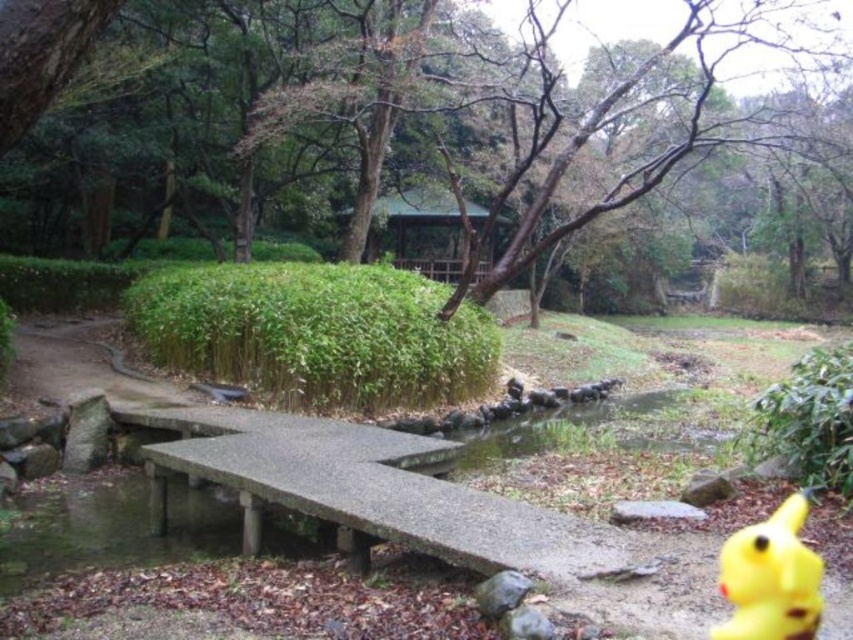
You are standing at the concrete bench in the foreground of the scene. You notice two points marked in the image. Which point, point 1 at coordinates [263,413] or point 2 at coordinates [759,570], is closer to you?

Point 1 at coordinates [263,413] is closer to you because it is further to the camera than point 2 at coordinates [759,570].

You are planning to set up a small picnic and have a gray concrete picnic table at center and a yellow rubber duck at lower right in your view. Which object is positioned to the left side of the other?

The gray concrete picnic table at center is positioned to the left of the yellow rubber duck at lower right.